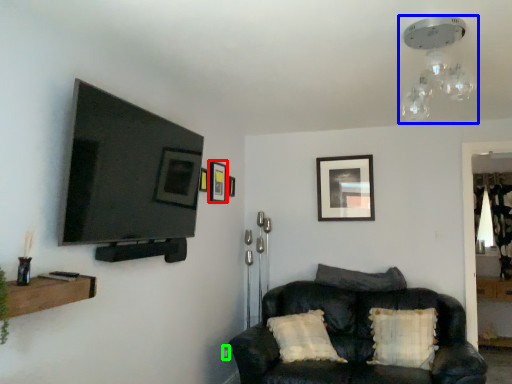
Question: Estimate the real-world distances between objects in this image. Which object is closer to picture frame (highlighted by a red box), light fixture (highlighted by a blue box) or electric outlet (highlighted by a green box)?

Choices:
 (A) light fixture
 (B) electric outlet

Answer: (B)